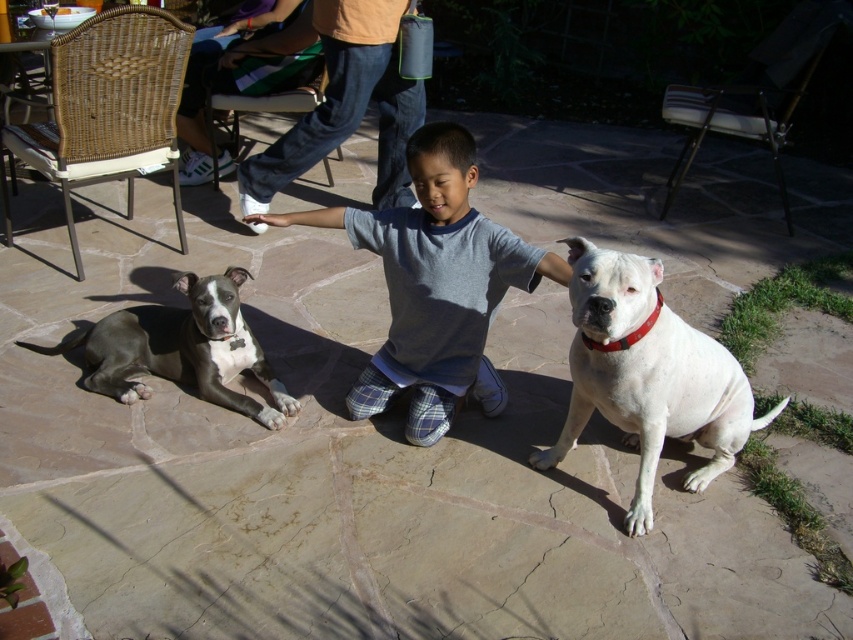
Question: Is gray cotton shirt at center further to camera compared to gray smooth pit bull at left?

Choices:
 (A) no
 (B) yes

Answer: (A)

Question: Does gray cotton shirt at center appear on the right side of white smooth dog at center?

Choices:
 (A) yes
 (B) no

Answer: (B)

Question: Can you confirm if white smooth dog at center is positioned below gray smooth pit bull at left?

Choices:
 (A) yes
 (B) no

Answer: (A)

Question: Which point appears farthest from the camera in this image?

Choices:
 (A) (721, 435)
 (B) (471, 257)

Answer: (B)

Question: Among these objects, which one is nearest to the camera?

Choices:
 (A) gray smooth pit bull at left
 (B) gray cotton shirt at center
 (C) white smooth dog at center

Answer: (C)

Question: Which of the following is the closest to the observer?

Choices:
 (A) (639, 339)
 (B) (410, 298)

Answer: (A)